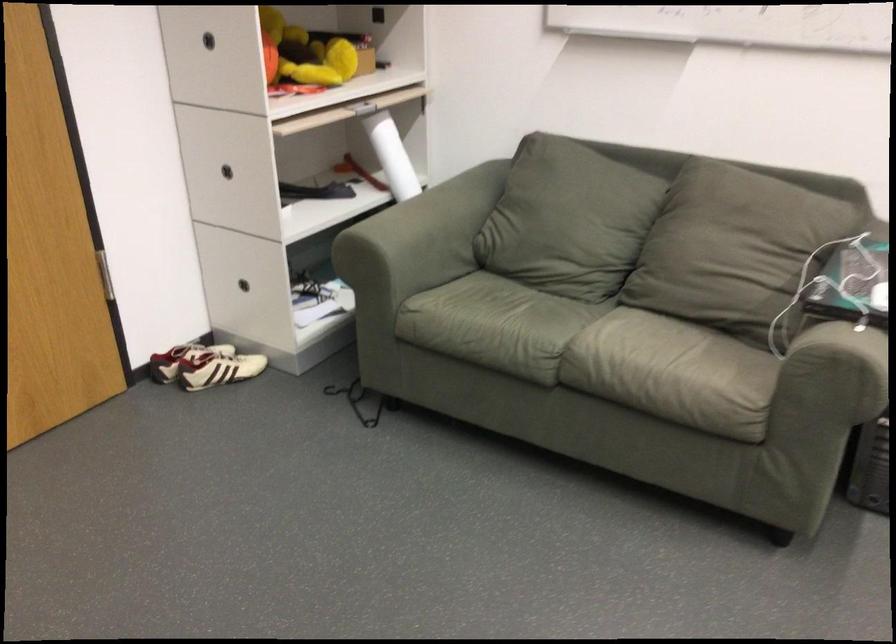
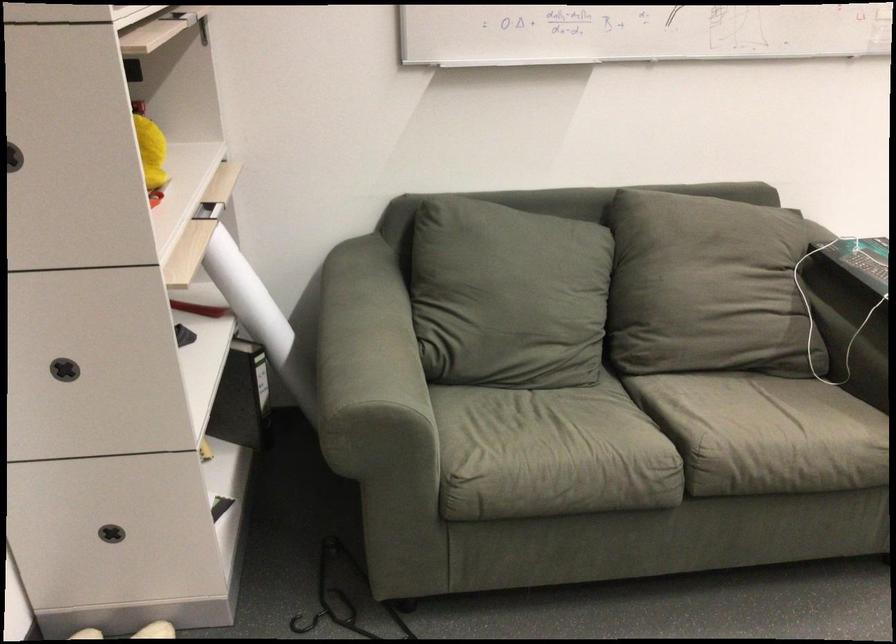
The point at [400,178] is marked in the first image. Where is the corresponding point in the second image?

(247, 296)